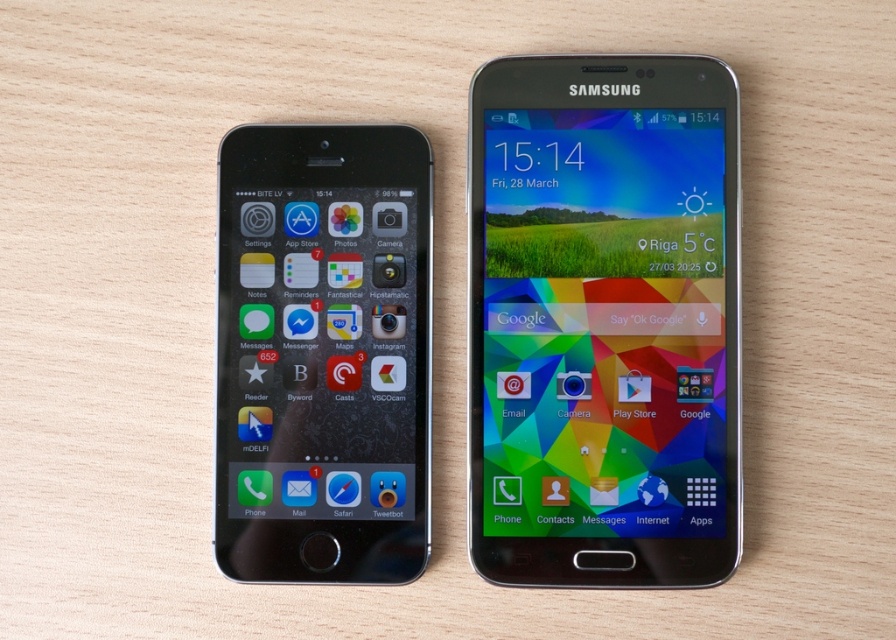
You are holding a ruler and want to measure the distance from your eyes to the point at the bottom of the iPhone home button. The point is labeled as point (470, 544). Can you estimate how far this point is from your eyes using the ruler?

The point (470, 544) is 28.90 inches away from the viewer, so the distance from your eyes to the point at the bottom of the iPhone home button is approximately 28.90 inches.

You are trying to choose between the metallic samsung smartphone at center and the matte black phone at left. Which one is taller?

The metallic samsung smartphone at center is much taller than the matte black phone at left.

You are setting up a display for a tech store and need to arrange the metallic samsung smartphone at center and the matte black phone at left according to the image. Which phone should be placed higher on the shelf?

The metallic samsung smartphone at center should be placed higher on the shelf because it is located above the matte black phone at left in the image.